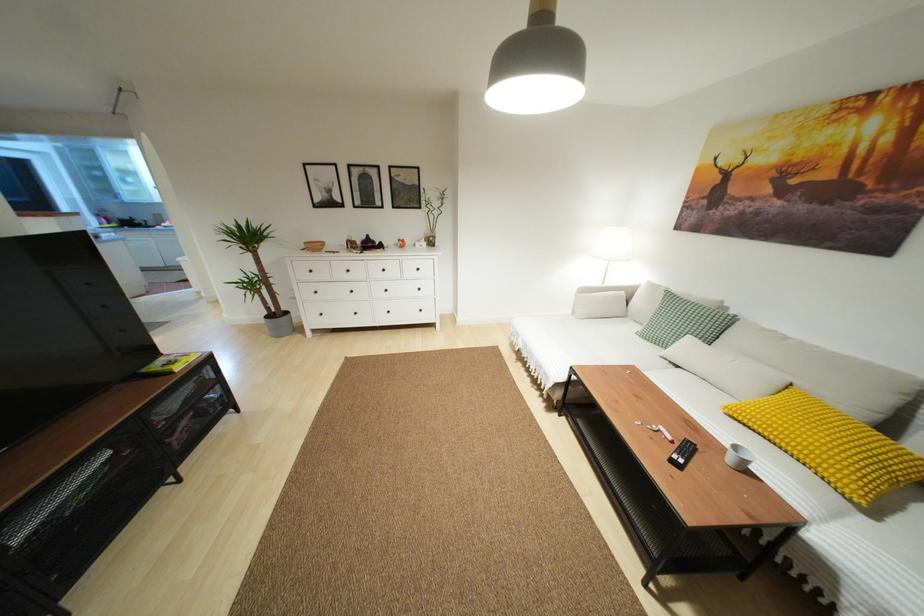
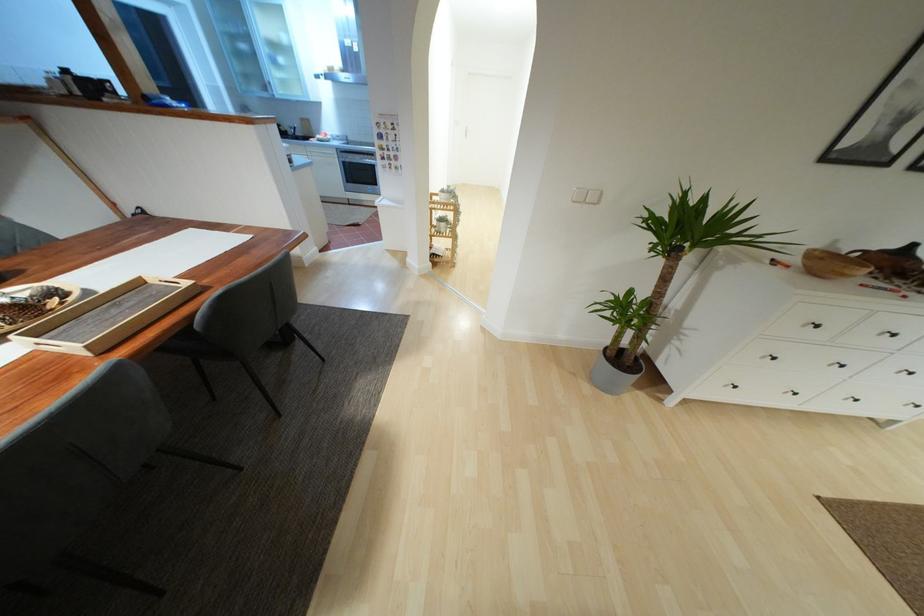
In the second image, find the point that corresponds to point 310,270 in the first image.

(817, 326)